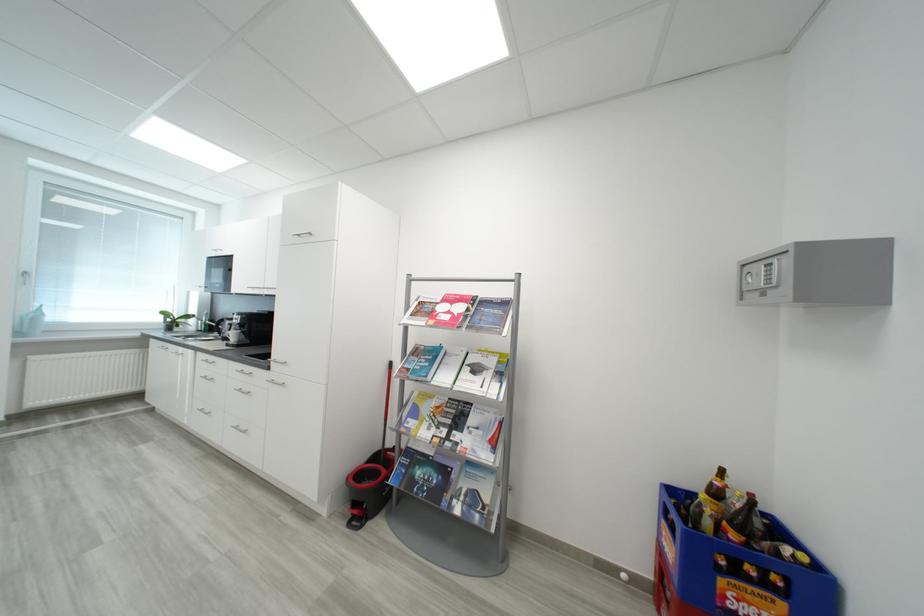
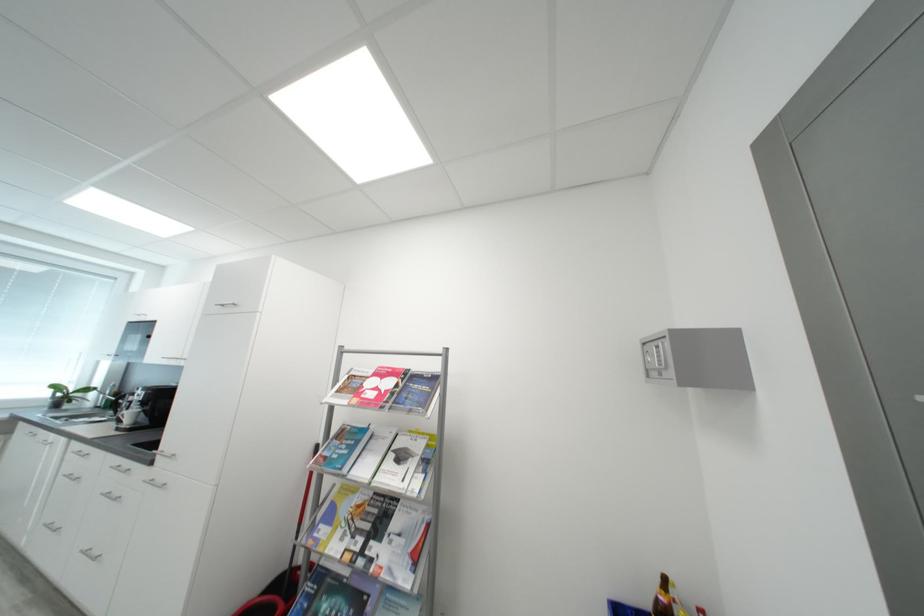
Find the pixel in the second image that matches pixel 240 336 in the first image.

(138, 416)